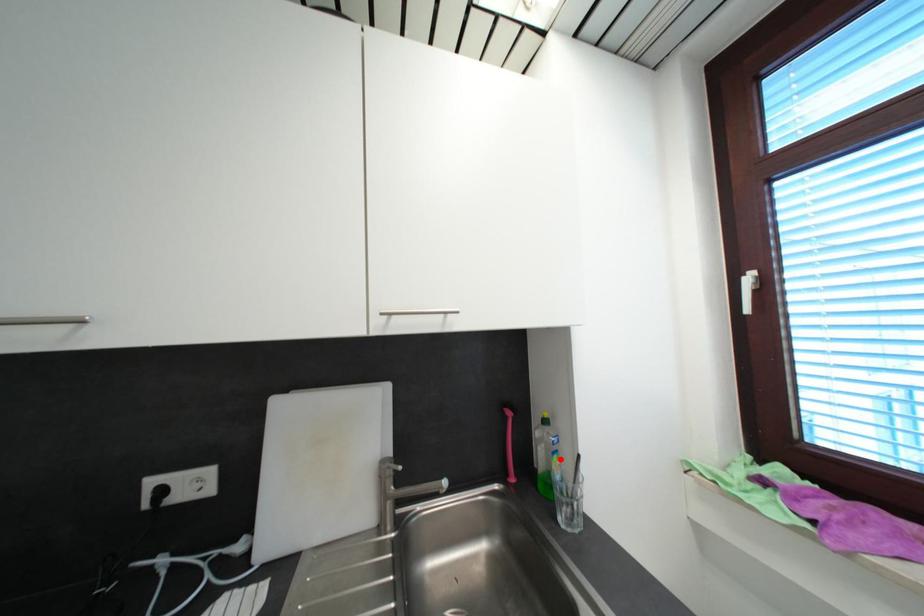
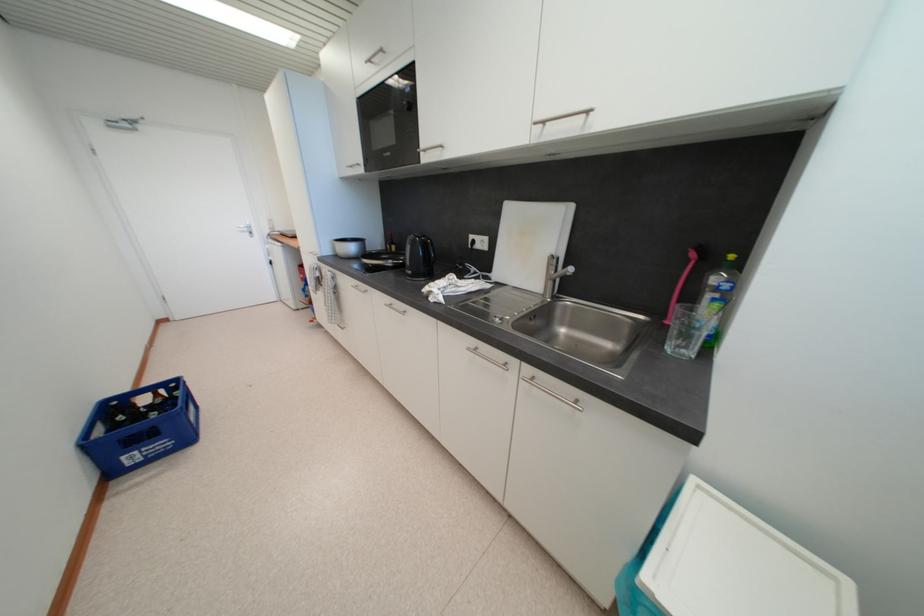
Locate, in the second image, the point that corresponds to the highlighted location in the first image.

(723, 307)